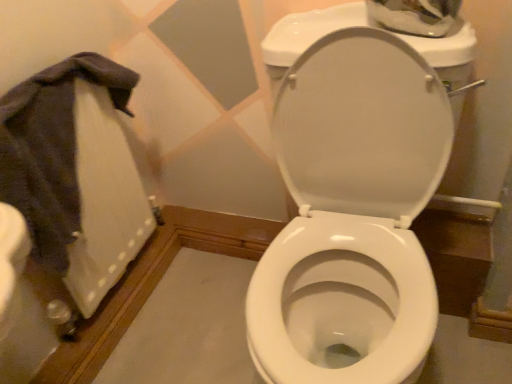
Describe the element at coordinates (51, 149) in the screenshot. The image size is (512, 384). I see `dark cotton towel at left` at that location.

In order to face dark cotton towel at left, should I rotate leftwards or rightwards?

Rotate your view left by about 22.712°.

This screenshot has height=384, width=512. In order to click on dark cotton towel at left in this screenshot , I will do `click(51, 149)`.

The height and width of the screenshot is (384, 512). In order to click on dark cotton towel at left in this screenshot , I will do `click(51, 149)`.